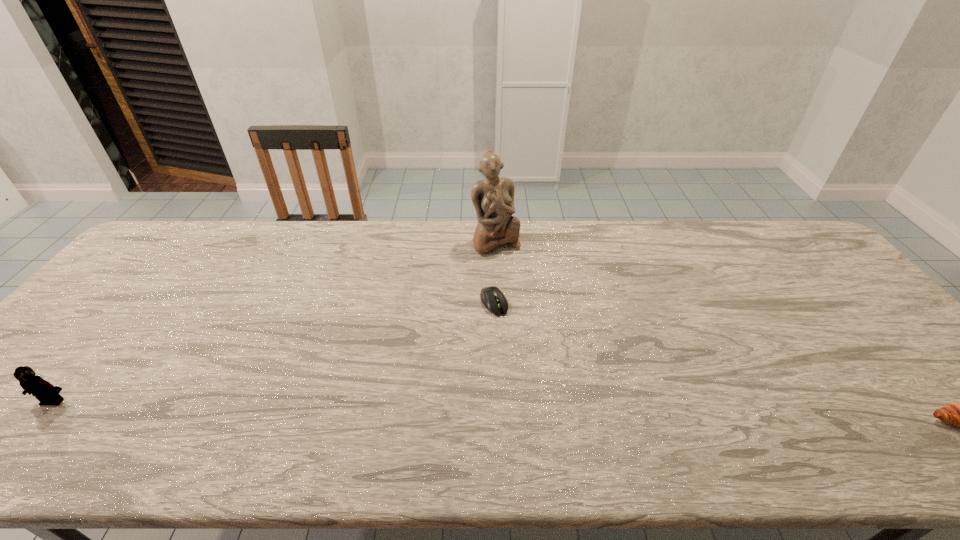
This screenshot has height=540, width=960. What are the coordinates of `vacant space at the far right corner` in the screenshot? It's located at (765, 241).

At what (x,y) coordinates should I click in order to perform the action: click on vacant point located between the second farthest object and the figurine. Please return your answer as a coordinate pair (x, y). Image resolution: width=960 pixels, height=540 pixels. Looking at the image, I should click on (495, 272).

Identify the location of free spot between the tallest object and the third farthest object. The width and height of the screenshot is (960, 540). (275, 321).

This screenshot has width=960, height=540. I want to click on vacant point located between the tallest object and the Lego, so click(275, 321).

Identify the location of free space between the computer mouse and the Lego. Image resolution: width=960 pixels, height=540 pixels. (274, 352).

Locate an element on the screen. This screenshot has width=960, height=540. vacant space that is in between the Lego and the figurine is located at coordinates (275, 321).

Locate which object is the third closest to the leftmost object. Please provide its 2D coordinates. Your answer should be formatted as a tuple, i.e. [(x, y)], where the tuple contains the x and y coordinates of a point satisfying the conditions above.

[(959, 414)]

The height and width of the screenshot is (540, 960). What are the coordinates of `object that is the third closest to the Lego` in the screenshot? It's located at (959, 414).